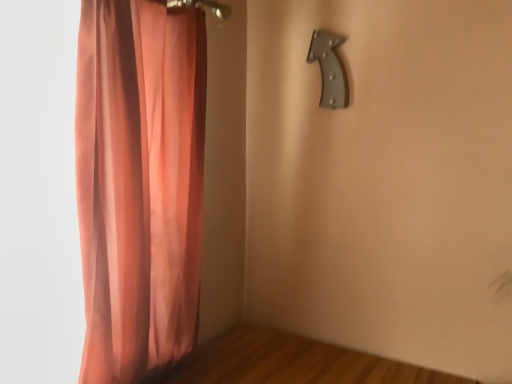
What do you see at coordinates (329, 69) in the screenshot? The width and height of the screenshot is (512, 384). I see `metallic gray door handle at upper right` at bounding box center [329, 69].

Where is `metallic gray door handle at upper right`? metallic gray door handle at upper right is located at coordinates (329, 69).

Locate an element on the screen. This screenshot has width=512, height=384. metallic gray door handle at upper right is located at coordinates (329, 69).